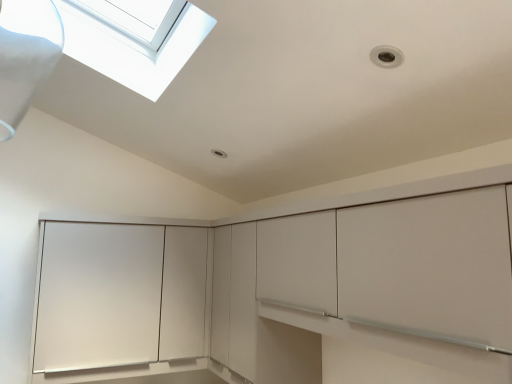
Question: Can you confirm if matte white cabinet at center is taller than matte white cabinet at lower left?

Choices:
 (A) no
 (B) yes

Answer: (B)

Question: Considering the relative sizes of matte white cabinet at center and matte white cabinet at lower left in the image provided, is matte white cabinet at center thinner than matte white cabinet at lower left?

Choices:
 (A) yes
 (B) no

Answer: (A)

Question: From a real-world perspective, is matte white cabinet at center over matte white cabinet at lower left?

Choices:
 (A) no
 (B) yes

Answer: (B)

Question: Can you confirm if matte white cabinet at center is positioned to the right of matte white cabinet at lower left?

Choices:
 (A) no
 (B) yes

Answer: (B)

Question: From the image's perspective, is matte white cabinet at center under matte white cabinet at lower left?

Choices:
 (A) yes
 (B) no

Answer: (B)

Question: Is matte white cabinet at center positioned behind matte white cabinet at lower left?

Choices:
 (A) yes
 (B) no

Answer: (B)

Question: Could you tell me if matte white cabinet at lower left is turned towards matte white cabinet at center?

Choices:
 (A) no
 (B) yes

Answer: (B)

Question: Considering the relative sizes of matte white cabinet at lower left and matte white cabinet at center in the image provided, is matte white cabinet at lower left taller than matte white cabinet at center?

Choices:
 (A) yes
 (B) no

Answer: (B)

Question: Is the surface of matte white cabinet at lower left in direct contact with matte white cabinet at center?

Choices:
 (A) no
 (B) yes

Answer: (A)

Question: Is matte white cabinet at lower left outside of matte white cabinet at center?

Choices:
 (A) yes
 (B) no

Answer: (A)

Question: Considering the relative sizes of matte white cabinet at lower left and matte white cabinet at center in the image provided, is matte white cabinet at lower left bigger than matte white cabinet at center?

Choices:
 (A) no
 (B) yes

Answer: (A)

Question: From the image's perspective, is matte white cabinet at lower left on matte white cabinet at center?

Choices:
 (A) yes
 (B) no

Answer: (B)

Question: In the image, is matte white cabinet at lower left on the left side or the right side of matte white cabinet at center?

Choices:
 (A) left
 (B) right

Answer: (A)